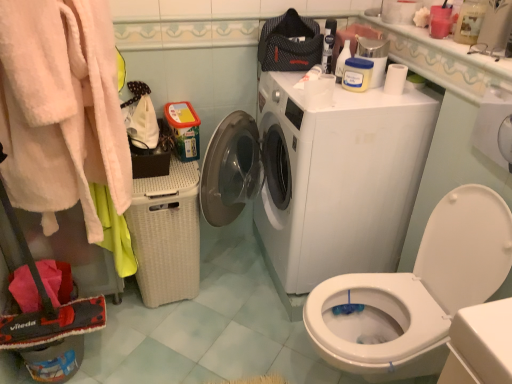
Where is `free spot in front of matte white jar at upper center`? free spot in front of matte white jar at upper center is located at coordinates (345, 96).